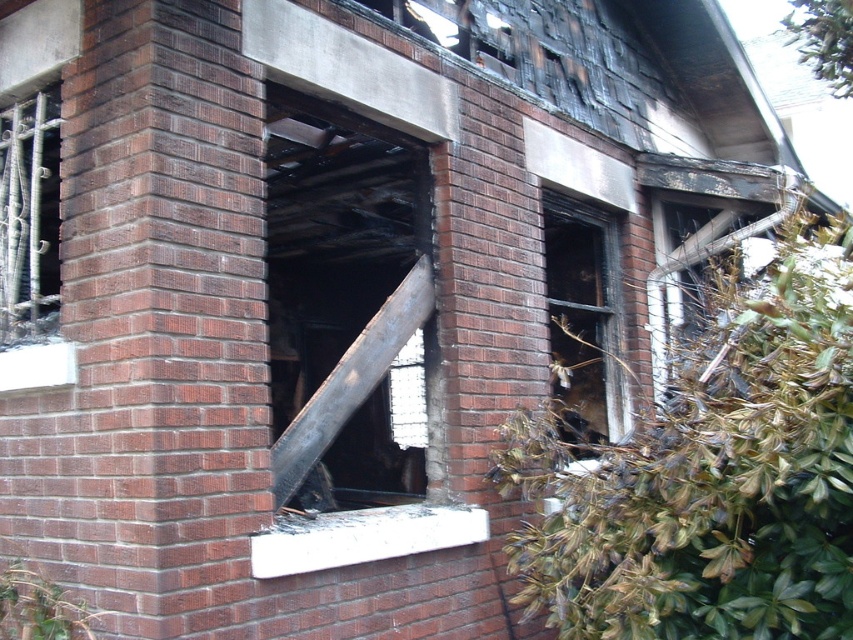
Question: From the image, what is the correct spatial relationship of charcoal wood beam at center in relation to black glass window at center?

Choices:
 (A) right
 (B) left

Answer: (B)

Question: Is the position of charcoal wood beam at center more distant than that of black glass window at center?

Choices:
 (A) yes
 (B) no

Answer: (B)

Question: Which point appears farthest from the camera in this image?

Choices:
 (A) (787, 193)
 (B) (405, 474)

Answer: (B)

Question: Which point is farther to the camera?

Choices:
 (A) (611, 428)
 (B) (717, 225)
 (C) (347, 368)

Answer: (B)

Question: In this image, where is charcoal wood beam at center located relative to black glass window at center?

Choices:
 (A) left
 (B) right

Answer: (A)

Question: Which point is farther to the camera?

Choices:
 (A) black glass window at center
 (B) charcoal wood beam at center

Answer: (A)